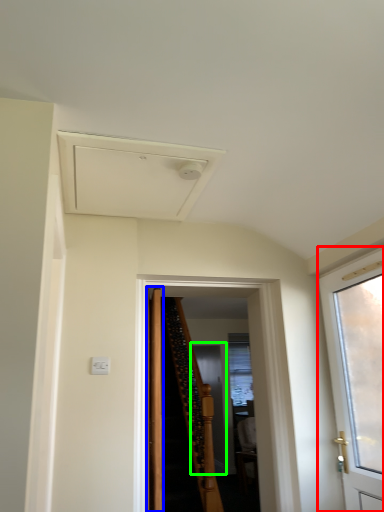
Question: Which is nearer to the door (highlighted by a red box)? door (highlighted by a blue box) or screen door (highlighted by a green box).

Choices:
 (A) door
 (B) screen door

Answer: (A)